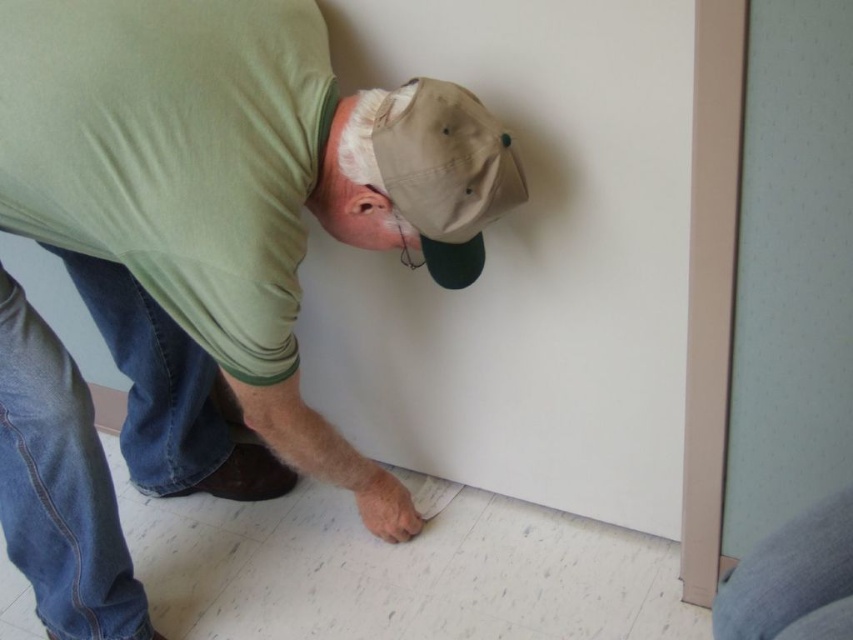
From the picture: You are an interior designer assessing the layout of this room. You notice the green matte shirt at center and the gray fabric at lower right. Which object has a greater width?

The green matte shirt at center has a greater width than the gray fabric at lower right.

You are a delivery person who needs to place a small box on the gray fabric at lower right. However, there is a tan fabric baseball cap at upper center in the way. Can you place the box there without moving the hat?

The tan fabric baseball cap at upper center is taller than the gray fabric at lower right, so placing the box might be difficult due to the hat obstructing the area. You should move the hat first to ensure there is enough space.

You are an interior designer observing the man in the scene. You need to place a decorative plaque on the wall that must be positioned above both the green matte shirt at center and the tan fabric baseball cap at upper center. Since the plaque needs to be above both objects, which one is lower so you can determine the minimum height required?

The green matte shirt at center has a greater height compared to tan fabric baseball cap at upper center. Therefore, the tan fabric baseball cap at upper center is lower. To place the plaque above both, it must be positioned higher than the green matte shirt at center, which is taller.